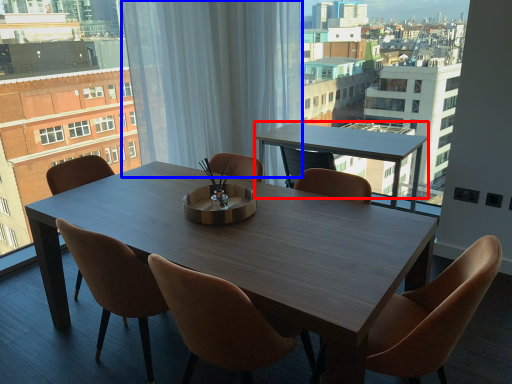
Question: Which point is further to the camera, coffee table (highlighted by a red box) or curtain (highlighted by a blue box)?

Choices:
 (A) coffee table
 (B) curtain

Answer: (B)